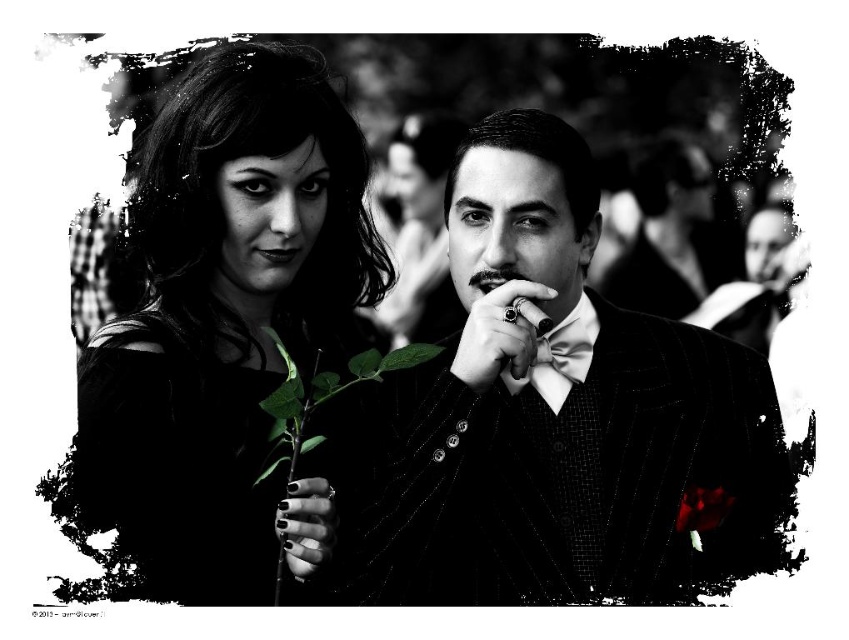
Looking at this image, you are an interior designer planning to place a small decorative item on a table near the green leafy plant at lower left and the green leafy stem at center. Which of the two should you choose to place the item closer to, considering their sizes?

The green leafy plant at lower left is larger in size than the green leafy stem at center, so you should place the item closer to the green leafy stem at center to avoid overcrowding.

You are a photographer adjusting the lighting for a portrait. You need to ensure that the matte black dress at left and the green leafy stem at center are evenly lit. Given their distance apart, do you think you can achieve this with a single light source placed directly in front of the camera?

The matte black dress at left and green leafy stem at center are 24.25 inches apart. Since the distance between them is relatively small, a single light source positioned appropriately in front could potentially illuminate both areas evenly, provided the light is broad enough and the setup allows for even distribution.